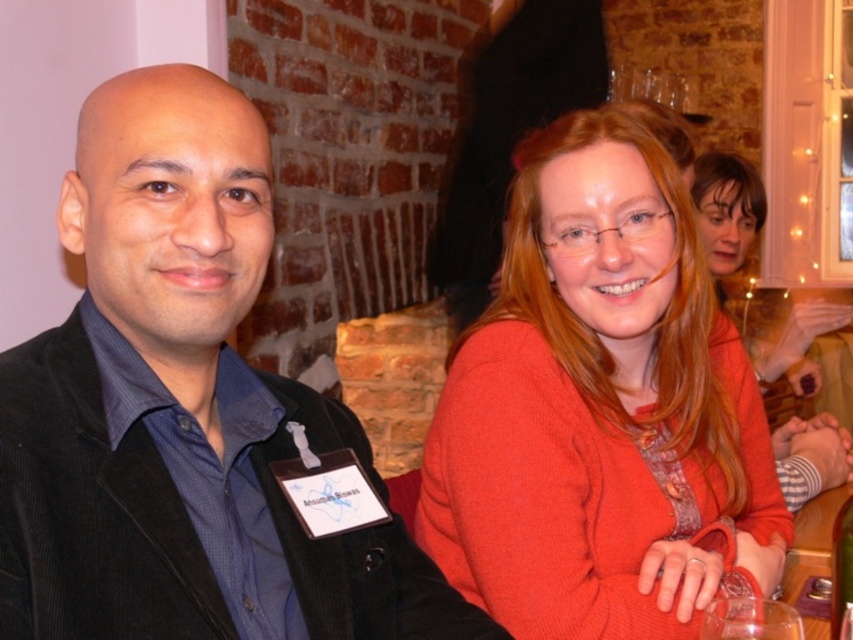
Question: Which of the following is the closest to the observer?

Choices:
 (A) transparent glass at lower right
 (B) transparent plastic bottle at lower right
 (C) black corduroy jacket at left

Answer: (C)

Question: Estimate the real-world distances between objects in this image. Which object is closer to the transparent glass at lower right?

Choices:
 (A) black corduroy jacket at left
 (B) matte orange sweater at center

Answer: (B)

Question: Which point is farther from the camera taking this photo?

Choices:
 (A) (845, 520)
 (B) (425, 541)

Answer: (B)

Question: Does black corduroy jacket at left have a lesser width compared to transparent glass at lower right?

Choices:
 (A) yes
 (B) no

Answer: (B)

Question: Is matte orange sweater at center thinner than transparent plastic bottle at lower right?

Choices:
 (A) yes
 (B) no

Answer: (B)

Question: Can you confirm if transparent glass at lower right is bigger than transparent plastic bottle at lower right?

Choices:
 (A) yes
 (B) no

Answer: (B)